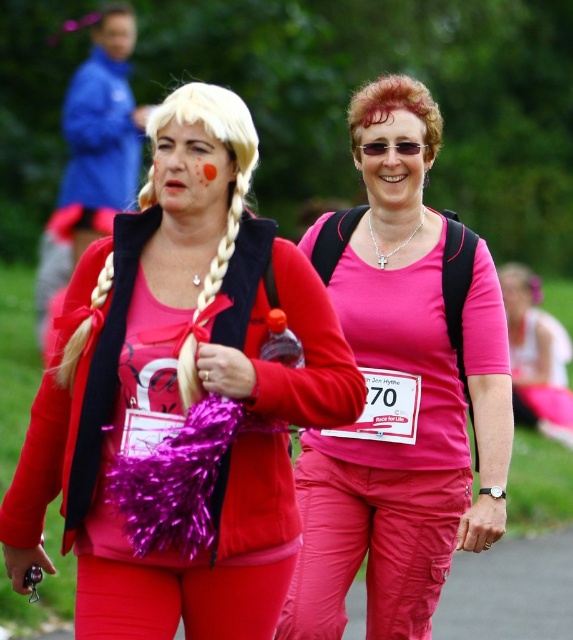
Question: Among these points, which one is nearest to the camera?

Choices:
 (A) (109, 51)
 (B) (417, 326)

Answer: (B)

Question: Based on their relative distances, which object is farther from the matte pink wig at center?

Choices:
 (A) matte pink shirt at center
 (B) sunglasses at center

Answer: (A)

Question: Which point is farther from the camera taking this photo?

Choices:
 (A) (382, 150)
 (B) (363, 468)

Answer: (A)

Question: Does pink matte shirt at center have a larger size compared to matte pink shirt at center?

Choices:
 (A) no
 (B) yes

Answer: (B)

Question: Does matte pink wig at center have a greater width compared to smooth skin face at upper left?

Choices:
 (A) yes
 (B) no

Answer: (A)

Question: Can you confirm if pink matte shirt at center is smaller than sunglasses at center?

Choices:
 (A) yes
 (B) no

Answer: (B)